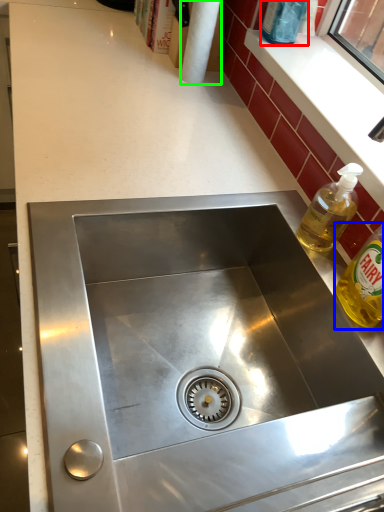
Question: Estimate the real-world distances between objects in this image. Which object is farther from bottle (highlighted by a red box), bottle (highlighted by a blue box) or paper towel (highlighted by a green box)?

Choices:
 (A) bottle
 (B) paper towel

Answer: (A)